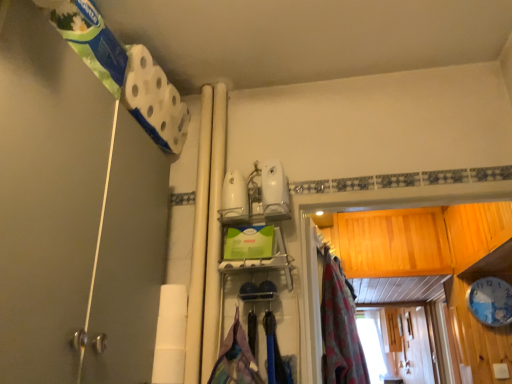
Question: From a real-world perspective, is textured fabric laundry at center positioned above or below floral fabric curtain at center?

Choices:
 (A) above
 (B) below

Answer: (B)

Question: Is textured fabric laundry at center situated inside floral fabric curtain at center or outside?

Choices:
 (A) outside
 (B) inside

Answer: (A)

Question: Which of these objects is positioned farthest from the textured fabric laundry at center?

Choices:
 (A) floral fabric curtain at center
 (B) white matte shower door at left
 (C) white matte toilet paper at lower left

Answer: (B)

Question: Which object is the closest to the white matte toilet paper at lower left?

Choices:
 (A) textured fabric laundry at center
 (B) floral fabric curtain at center
 (C) white matte shower door at left

Answer: (A)